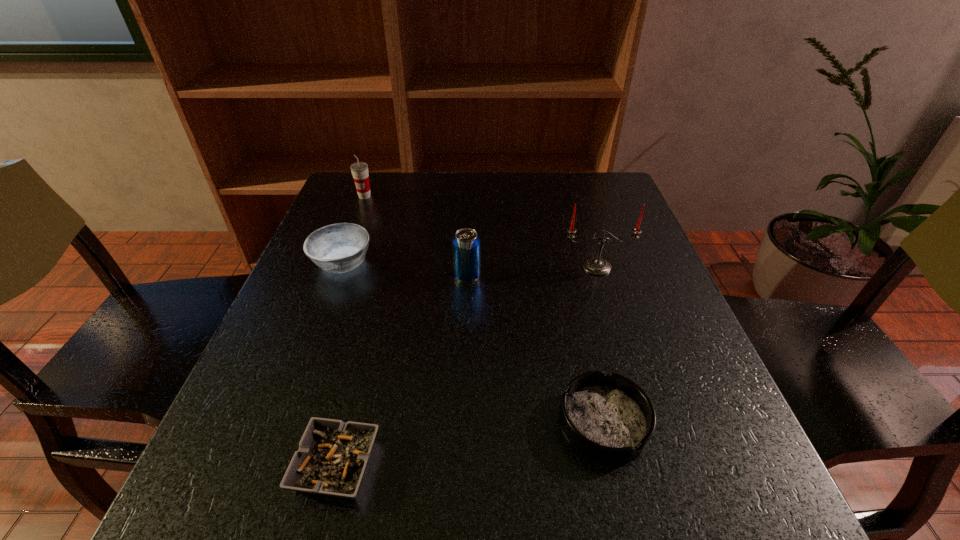
Find the location of `the tallest object`. the tallest object is located at coordinates (598, 266).

Locate an element on the screen. The height and width of the screenshot is (540, 960). the farthest object is located at coordinates (359, 170).

Identify the location of beer can. This screenshot has width=960, height=540. (466, 244).

At what (x,y) coordinates should I click in order to perform the action: click on the farthest ashtray. Please return your answer as a coordinate pair (x, y). Looking at the image, I should click on (337, 248).

Where is `the tallest ashtray`? The width and height of the screenshot is (960, 540). the tallest ashtray is located at coordinates 337,248.

Find the location of a particular element. The width and height of the screenshot is (960, 540). the second tallest ashtray is located at coordinates (609, 418).

Where is `the rightmost ashtray`? The image size is (960, 540). the rightmost ashtray is located at coordinates (609, 418).

Identify the location of the shortest object. This screenshot has width=960, height=540. (332, 456).

Where is `vacant space located 0.250m on the front-facing side of the candle`? The image size is (960, 540). vacant space located 0.250m on the front-facing side of the candle is located at coordinates (628, 368).

Where is `vacant space located on the side of the cup with the logo`? This screenshot has height=540, width=960. vacant space located on the side of the cup with the logo is located at coordinates (333, 281).